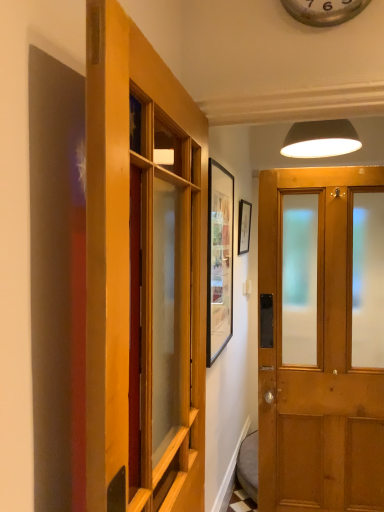
Find the location of a particular element. This screenshot has height=512, width=384. matte black lampshade at upper center is located at coordinates (320, 139).

What do you see at coordinates (244, 226) in the screenshot?
I see `matte black picture frame at upper center` at bounding box center [244, 226].

What is the approximate height of metallic silver clock at upper center?

The height of metallic silver clock at upper center is 37.34 centimeters.

This screenshot has height=512, width=384. Describe the element at coordinates (317, 360) in the screenshot. I see `wooden door at center, arranged as the first door when viewed from the right` at that location.

Identify the location of matte black lampshade at upper center. This screenshot has width=384, height=512. (320, 139).

Is point (244, 241) closer or farther from the camera than point (290, 5)?

Point (244, 241) is farther from the camera than point (290, 5).

Does matte black picture frame at upper center have a larger size compared to metallic silver clock at upper center?

Yes, matte black picture frame at upper center is bigger than metallic silver clock at upper center.

Considering the relative sizes of matte black picture frame at upper center and metallic silver clock at upper center in the image provided, is matte black picture frame at upper center wider than metallic silver clock at upper center?

Indeed, matte black picture frame at upper center has a greater width compared to metallic silver clock at upper center.

Which of these two, wooden door at center, arranged as the first door when viewed from the left, or metallic silver clock at upper center, stands shorter?

metallic silver clock at upper center.

Considering the positions of objects wooden door at center, arranged as the first door when viewed from the left, and metallic silver clock at upper center in the image provided, who is more to the left, wooden door at center, arranged as the first door when viewed from the left, or metallic silver clock at upper center?

wooden door at center, arranged as the first door when viewed from the left, is more to the left.

What's the angular difference between wooden door at center, marked as the second door in a right-to-left arrangement, and metallic silver clock at upper center's facing directions?

The facing directions of wooden door at center, marked as the second door in a right-to-left arrangement, and metallic silver clock at upper center are 92.4 degrees apart.

Considering the relative sizes of wooden door at center, arranged as the first door when viewed from the left, and metallic silver clock at upper center in the image provided, is wooden door at center, arranged as the first door when viewed from the left, smaller than metallic silver clock at upper center?

Actually, wooden door at center, arranged as the first door when viewed from the left, might be larger than metallic silver clock at upper center.

Is wooden door at center, arranged as the first door when viewed from the left, looking in the opposite direction of matte black picture frame at upper center?

wooden door at center, arranged as the first door when viewed from the left, is not turned away from matte black picture frame at upper center.

Between wooden door at center, arranged as the first door when viewed from the left, and matte black picture frame at upper center, which one has larger width?

With larger width is wooden door at center, arranged as the first door when viewed from the left.

You are a GUI agent. You are given a task and a screenshot of the screen. Output one action in this format:
    pyautogui.click(x=<x>, y=<y>)
    Task: Click on the door that is the 2nd object directly below the matte black picture frame at upper center (from a real-world perspective)
    The image size is (384, 512).
    Given the screenshot: What is the action you would take?
    pyautogui.click(x=142, y=275)

Can you confirm if wooden door at center, arranged as the first door when viewed from the left, is positioned to the left of matte black picture frame at upper center?

Yes, wooden door at center, arranged as the first door when viewed from the left, is to the left of matte black picture frame at upper center.

Can you confirm if metallic silver clock at upper center is positioned to the left of wooden door at center, marked as the 2th door in a left-to-right arrangement?

No.

Is metallic silver clock at upper center looking in the opposite direction of wooden door at center, marked as the 2th door in a left-to-right arrangement?

metallic silver clock at upper center does not have its back to wooden door at center, marked as the 2th door in a left-to-right arrangement.

Which object is closer to the camera, metallic silver clock at upper center or wooden door at center, arranged as the first door when viewed from the right?

Answer: wooden door at center, arranged as the first door when viewed from the right, is in front.

Consider the image. Considering the sizes of objects metallic silver clock at upper center and wooden door at center, arranged as the first door when viewed from the right, in the image provided, who is smaller, metallic silver clock at upper center or wooden door at center, arranged as the first door when viewed from the right,?

Smaller between the two is metallic silver clock at upper center.

Is wooden door at center, marked as the second door in a right-to-left arrangement, at the left side of wooden door at center, marked as the 2th door in a left-to-right arrangement?

Correct, you'll find wooden door at center, marked as the second door in a right-to-left arrangement, to the left of wooden door at center, marked as the 2th door in a left-to-right arrangement.

Is wooden door at center, marked as the second door in a right-to-left arrangement, closer to the viewer compared to wooden door at center, marked as the 2th door in a left-to-right arrangement?

Yes, wooden door at center, marked as the second door in a right-to-left arrangement, is in front of wooden door at center, marked as the 2th door in a left-to-right arrangement.

How different are the orientations of wooden door at center, marked as the second door in a right-to-left arrangement, and wooden door at center, arranged as the first door when viewed from the right, in degrees?

They differ by 92.3 degrees in their facing directions.

Is point (197, 313) farther from camera compared to point (279, 370)?

No, it is in front of (279, 370).

Considering the positions of points (304, 3) and (239, 229), is point (304, 3) closer to camera compared to point (239, 229)?

Yes, it is in front of point (239, 229).

Is metallic silver clock at upper center thinner than matte black picture frame at upper center?

Indeed, metallic silver clock at upper center has a lesser width compared to matte black picture frame at upper center.

Is metallic silver clock at upper center in contact with matte black picture frame at upper center?

No, metallic silver clock at upper center is not making contact with matte black picture frame at upper center.

Which is closer to the camera, (259, 478) or (118, 316)?

Point (259, 478).

How much distance is there between wooden door at center, arranged as the first door when viewed from the right, and wooden door at center, arranged as the first door when viewed from the left?

wooden door at center, arranged as the first door when viewed from the right, and wooden door at center, arranged as the first door when viewed from the left, are 3.88 feet apart from each other.

In terms of size, does wooden door at center, arranged as the first door when viewed from the right, appear bigger or smaller than wooden door at center, marked as the second door in a right-to-left arrangement?

Considering their sizes, wooden door at center, arranged as the first door when viewed from the right, takes up less space than wooden door at center, marked as the second door in a right-to-left arrangement.

From the image's perspective, is wooden door at center, marked as the 2th door in a left-to-right arrangement, above wooden door at center, arranged as the first door when viewed from the left?

Yes, from the image's perspective, wooden door at center, marked as the 2th door in a left-to-right arrangement, is on top of wooden door at center, arranged as the first door when viewed from the left.

The image size is (384, 512). I want to click on clock above the matte black picture frame at upper center (from a real-world perspective), so click(324, 11).

Locate an element on the screen. The image size is (384, 512). clock behind the wooden door at center, arranged as the first door when viewed from the left is located at coordinates (324, 11).

Which object lies further to the anchor point wooden door at center, marked as the second door in a right-to-left arrangement, matte black picture frame at upper center or metallic silver clock at upper center?

Among the two, matte black picture frame at upper center is located further to wooden door at center, marked as the second door in a right-to-left arrangement.

When comparing their distances from wooden door at center, marked as the 2th door in a left-to-right arrangement, does wooden door at center, arranged as the first door when viewed from the left, or metallic silver clock at upper center seem further?

metallic silver clock at upper center lies further to wooden door at center, marked as the 2th door in a left-to-right arrangement, than the other object.

Based on their spatial positions, is metallic silver clock at upper center or matte black picture frame at upper center further from matte black lampshade at upper center?

Among the two, metallic silver clock at upper center is located further to matte black lampshade at upper center.

Consider the image. Estimate the real-world distances between objects in this image. Which object is further from metallic silver clock at upper center, wooden door at center, marked as the 2th door in a left-to-right arrangement, or matte black picture frame at upper center?

Based on the image, matte black picture frame at upper center appears to be further to metallic silver clock at upper center.

From the image, which object appears to be farther from matte black picture frame at upper center, metallic silver clock at upper center or wooden door at center, marked as the second door in a right-to-left arrangement?

wooden door at center, marked as the second door in a right-to-left arrangement, is positioned further to the anchor matte black picture frame at upper center.

When comparing their distances from wooden door at center, marked as the 2th door in a left-to-right arrangement, does metallic silver clock at upper center or wooden door at center, marked as the second door in a right-to-left arrangement, seem further?

metallic silver clock at upper center lies further to wooden door at center, marked as the 2th door in a left-to-right arrangement, than the other object.

From the image, which object appears to be nearer to metallic silver clock at upper center, matte black lampshade at upper center or matte black picture frame at upper center?

matte black lampshade at upper center lies closer to metallic silver clock at upper center than the other object.

When comparing their distances from metallic silver clock at upper center, does wooden door at center, marked as the 2th door in a left-to-right arrangement, or matte black lampshade at upper center seem closer?

The object closer to metallic silver clock at upper center is matte black lampshade at upper center.

Where is `clock located between wooden door at center, marked as the 2th door in a left-to-right arrangement, and matte black picture frame at upper center in the depth direction`? This screenshot has height=512, width=384. clock located between wooden door at center, marked as the 2th door in a left-to-right arrangement, and matte black picture frame at upper center in the depth direction is located at coordinates (324, 11).

Locate an element on the screen. The image size is (384, 512). clock between wooden door at center, marked as the second door in a right-to-left arrangement, and matte black lampshade at upper center, along the z-axis is located at coordinates (324, 11).

Find the location of a particular element. door between wooden door at center, arranged as the first door when viewed from the left, and matte black picture frame at upper center from front to back is located at coordinates (317, 360).

You are a GUI agent. You are given a task and a screenshot of the screen. Output one action in this format:
    pyautogui.click(x=<x>, y=<y>)
    Task: Click on the clock between wooden door at center, marked as the second door in a right-to-left arrangement, and matte black picture frame at upper center from front to back
    
    Given the screenshot: What is the action you would take?
    pyautogui.click(x=324, y=11)